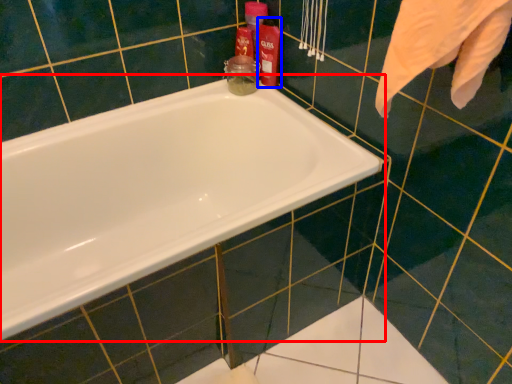
Question: Among these objects, which one is nearest to the camera, bathtub (highlighted by a red box) or cleaning product (highlighted by a blue box)?

Choices:
 (A) bathtub
 (B) cleaning product

Answer: (A)